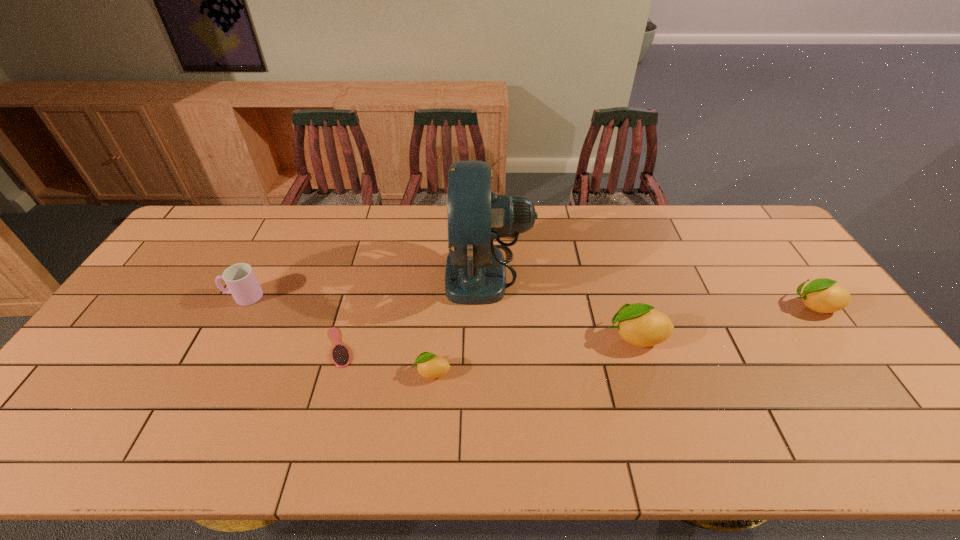
At what (x,y) coordinates should I click in order to perform the action: click on vacant space at the near edge of the desktop. Please return your answer as a coordinate pair (x, y). The width and height of the screenshot is (960, 540). Looking at the image, I should click on 774,389.

Identify the location of free space at the left edge. The image size is (960, 540). [146, 318].

You are a GUI agent. You are given a task and a screenshot of the screen. Output one action in this format:
    pyautogui.click(x=<x>, y=<y>)
    Task: Click on the free location at the right edge
    This screenshot has height=540, width=960.
    Given the screenshot: What is the action you would take?
    pyautogui.click(x=871, y=378)

Identify the location of vacant space at the far left corner of the desktop. The image size is (960, 540). (204, 242).

Find the location of `vacant space at the far right corner`. vacant space at the far right corner is located at coordinates (761, 241).

Where is `free point between the tallest object and the hairbrush`? Image resolution: width=960 pixels, height=540 pixels. free point between the tallest object and the hairbrush is located at coordinates (414, 309).

You are a GUI agent. You are given a task and a screenshot of the screen. Output one action in this format:
    pyautogui.click(x=<x>, y=<y>)
    Task: Click on the vacant region between the second lemon from left to right and the farthest lemon
    
    Given the screenshot: What is the action you would take?
    pyautogui.click(x=725, y=321)

I want to click on unoccupied position between the tallest object and the leftmost object, so (366, 284).

This screenshot has height=540, width=960. Identify the location of empty space that is in between the shortest lemon and the second lemon from right to left. (534, 354).

At what (x,y) coordinates should I click in order to perform the action: click on empty space that is in between the leftmost lemon and the fifth object from left to right. Please return your answer as a coordinate pair (x, y). This screenshot has width=960, height=540. Looking at the image, I should click on point(534,354).